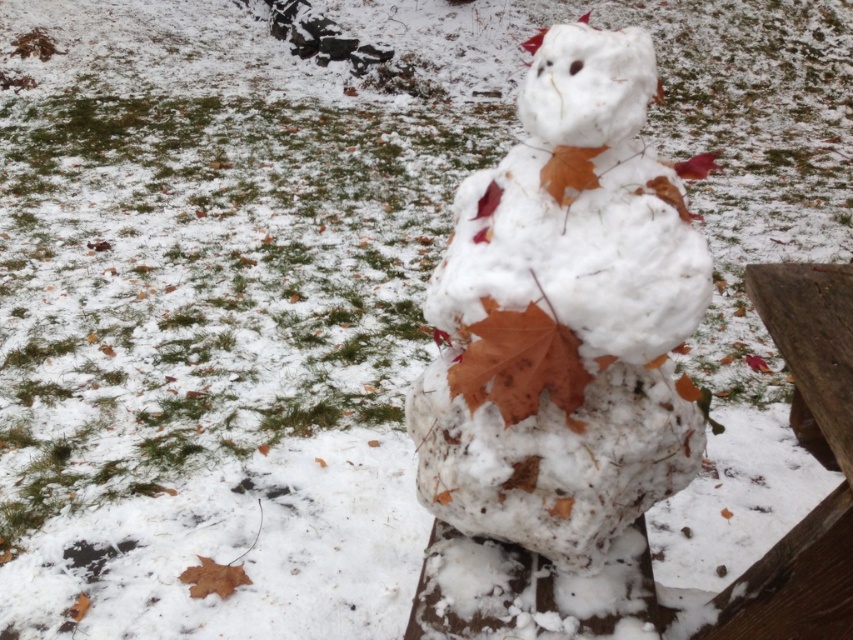
Can you confirm if brown matte leaf at center is positioned to the right of brown matte leaf at lower left?

Indeed, brown matte leaf at center is positioned on the right side of brown matte leaf at lower left.

Who is positioned more to the right, brown matte leaf at center or brown matte leaf at lower left?

Positioned to the right is brown matte leaf at center.

This screenshot has height=640, width=853. In order to click on brown matte leaf at center in this screenshot , I will do `click(519, 362)`.

Who is positioned more to the right, white fluffy snowman at center or brown matte leaf at lower left?

From the viewer's perspective, white fluffy snowman at center appears more on the right side.

Which of these two, white fluffy snowman at center or brown matte leaf at lower left, stands shorter?

→ With less height is brown matte leaf at lower left.

Who is more forward, (519, 499) or (222, 572)?

Positioned in front is point (519, 499).

Where is `white fluffy snowman at center`? This screenshot has height=640, width=853. white fluffy snowman at center is located at coordinates (566, 316).

Does white fluffy snowman at center have a greater height compared to wooden bench at center?

Correct, white fluffy snowman at center is much taller as wooden bench at center.

Measure the distance between white fluffy snowman at center and camera.

white fluffy snowman at center is 3.91 feet away from camera.

You are a GUI agent. You are given a task and a screenshot of the screen. Output one action in this format:
    pyautogui.click(x=<x>, y=<y>)
    Task: Click on the white fluffy snowman at center
    
    Given the screenshot: What is the action you would take?
    click(566, 316)

At what (x,y) coordinates should I click in order to perform the action: click on white fluffy snowman at center. Please return your answer as a coordinate pair (x, y). The width and height of the screenshot is (853, 640). Looking at the image, I should click on (566, 316).